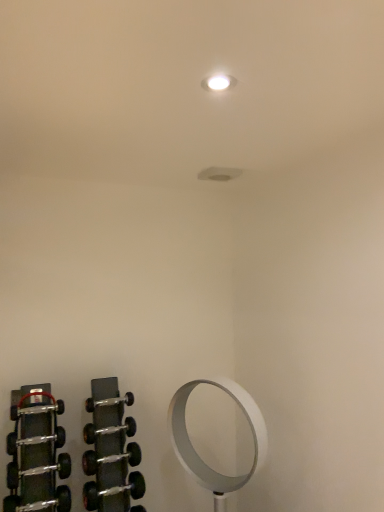
Question: Is silver metallic dumbbell at lower left, placed as the 8th dumbbell when sorted from top to bottom, taller or shorter than polished silver dumbbell at lower left, the seventh dumbbell in the bottom-to-top sequence?

Choices:
 (A) short
 (B) tall

Answer: (B)

Question: Looking at the image, does silver metallic dumbbell at lower left, placed as the 8th dumbbell when sorted from top to bottom, seem bigger or smaller compared to polished silver dumbbell at lower left, the 2th dumbbell when ordered from top to bottom?

Choices:
 (A) small
 (B) big

Answer: (B)

Question: Considering the real-world distances, which object is closest to the white metallic mirror at lower right?

Choices:
 (A) polished silver dumbbell at lower left, the seventh dumbbell in the bottom-to-top sequence
 (B) silver metallic dumbbell at lower left, the first dumbbell in the bottom-to-top sequence
 (C) silver metallic dumbbell at lower left, the fourth dumbbell positioned from the top
 (D) silver metallic dumbbell at lower left, which is the third dumbbell in bottom-to-top order
 (E) black rubber dumbbell at left, marked as the sixth dumbbell in a bottom-to-top arrangement

Answer: (D)

Question: Which is nearer to the black rubber dumbbell at lower left, which is the 7th dumbbell in top-to-bottom order?

Choices:
 (A) silver metallic dumbbell at lower left, acting as the fourth dumbbell starting from the bottom
 (B) silver metallic dumbbell at lower left, the fourth dumbbell positioned from the top
 (C) polished silver dumbbell at lower left, the seventh dumbbell in the bottom-to-top sequence
 (D) white metallic mirror at lower right
 (E) black rubber dumbbell at left, the third dumbbell positioned from the top

Answer: (A)